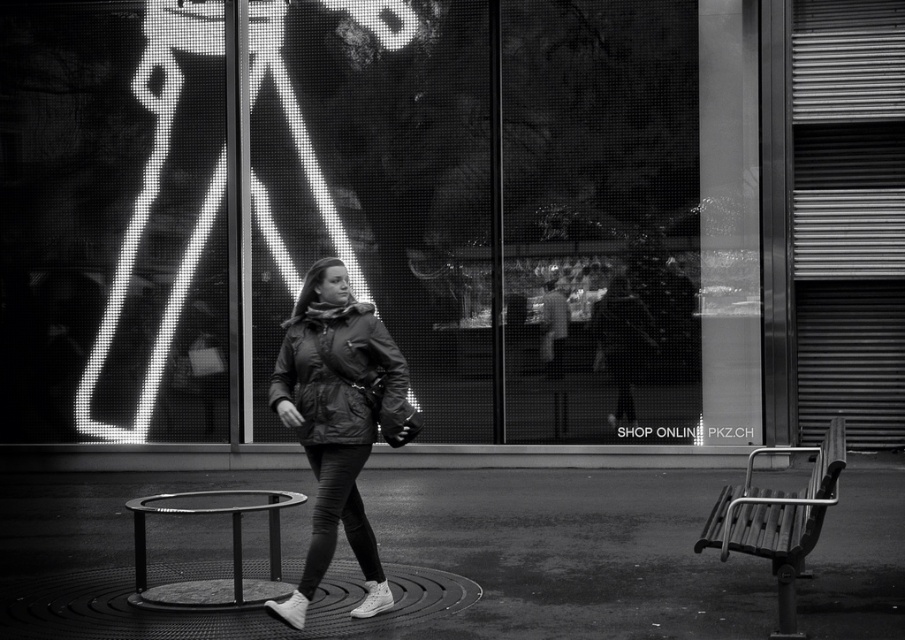
Question: Is matte glass shop window at center positioned behind metallic stool at center?

Choices:
 (A) yes
 (B) no

Answer: (A)

Question: Is matte glass shop window at center smaller than metallic stool at center?

Choices:
 (A) no
 (B) yes

Answer: (B)

Question: Which of the following is the closest to the observer?

Choices:
 (A) (325, 470)
 (B) (408, 209)

Answer: (A)

Question: Which of the following is the farthest from the observer?

Choices:
 (A) (258, 579)
 (B) (540, 289)

Answer: (B)

Question: Does matte glass shop window at center have a smaller size compared to circular metal grate at center?

Choices:
 (A) yes
 (B) no

Answer: (A)

Question: Estimate the real-world distances between objects in this image. Which object is farther from the matte black jacket at center?

Choices:
 (A) circular metal grate at center
 (B) matte glass shop window at center

Answer: (B)